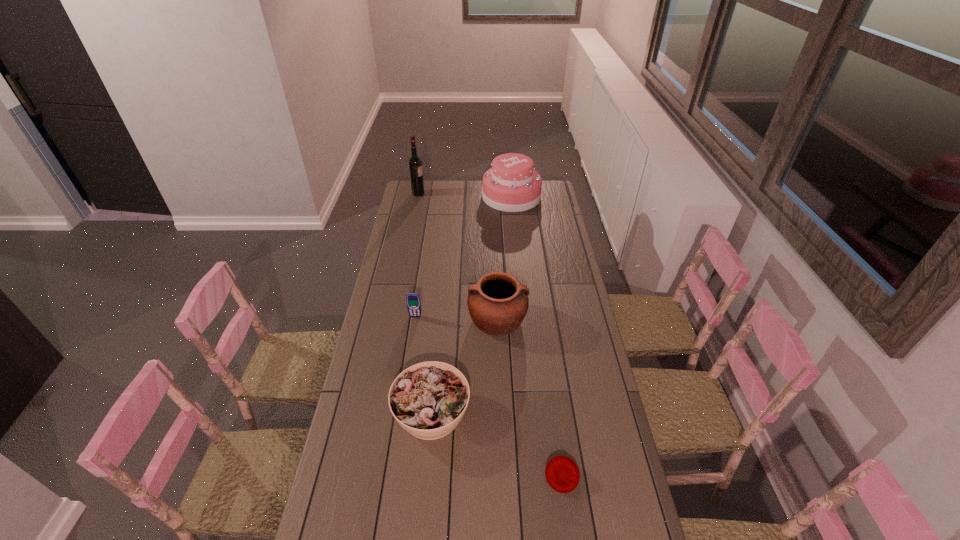
I want to click on vacant space situated on the right of the pottery, so click(x=568, y=320).

Image resolution: width=960 pixels, height=540 pixels. I want to click on free space located on the front-facing side of the cellular telephone, so (407, 368).

You are a GUI agent. You are given a task and a screenshot of the screen. Output one action in this format:
    pyautogui.click(x=<x>, y=<y>)
    Task: Click on the vacant space located 0.160m on the front of the second nearest object
    The width and height of the screenshot is (960, 540).
    Given the screenshot: What is the action you would take?
    pyautogui.click(x=423, y=502)

Where is `free space located 0.110m on the seat area of the nearest object`? Image resolution: width=960 pixels, height=540 pixels. free space located 0.110m on the seat area of the nearest object is located at coordinates (570, 535).

Locate an element on the screen. This screenshot has height=540, width=960. wine bottle situated at the far edge is located at coordinates (415, 162).

In order to click on cake situated at the far edge in this screenshot , I will do `click(512, 185)`.

Locate an element on the screen. This screenshot has height=540, width=960. wine bottle positioned at the left edge is located at coordinates (415, 162).

Image resolution: width=960 pixels, height=540 pixels. What are the coordinates of `cellular telephone situated at the left edge` in the screenshot? It's located at (413, 302).

Find the location of a particular element. salad at the left edge is located at coordinates (429, 399).

This screenshot has height=540, width=960. In order to click on cake located at the right edge in this screenshot , I will do `click(512, 185)`.